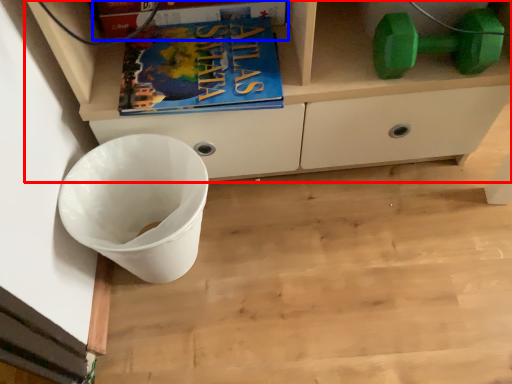
Question: Which object is further to the camera taking this photo, cabinetry (highlighted by a red box) or paperback book (highlighted by a blue box)?

Choices:
 (A) cabinetry
 (B) paperback book

Answer: (B)